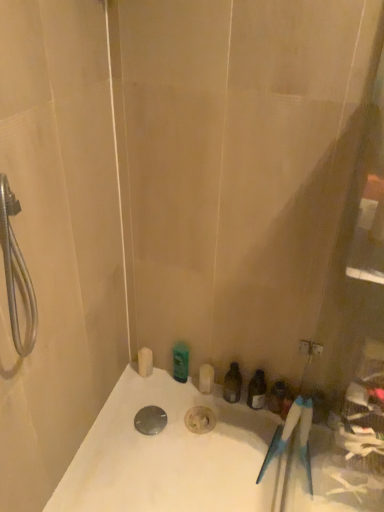
Identify the location of vacant area located to the right-hand side of green matte bottle at upper center, the second toiletry in the left-to-right sequence. The width and height of the screenshot is (384, 512). (208, 398).